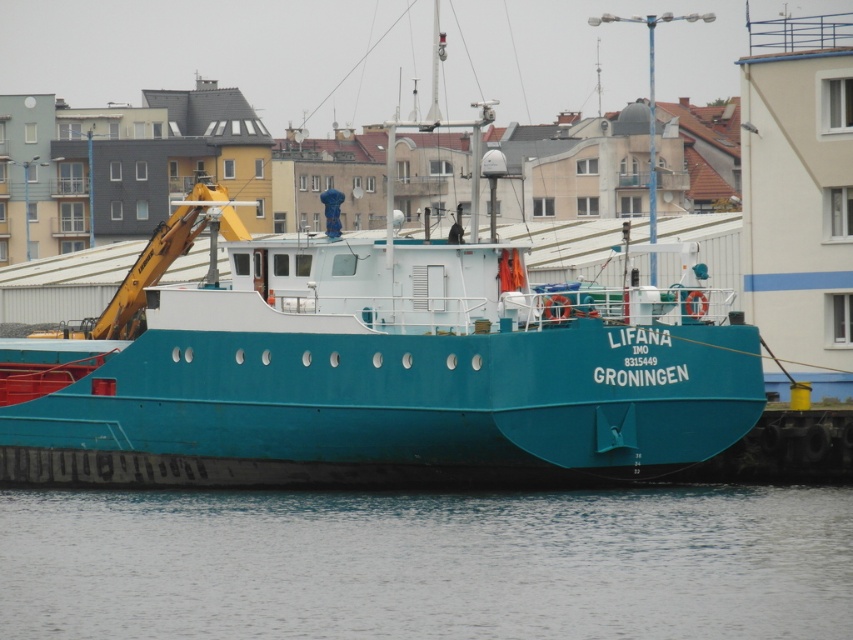
Question: Where is teal matte boat at center located in relation to transparent water at lower center in the image?

Choices:
 (A) left
 (B) right

Answer: (A)

Question: Is teal matte boat at center above transparent water at lower center?

Choices:
 (A) yes
 (B) no

Answer: (A)

Question: Is teal matte boat at center wider than transparent water at lower center?

Choices:
 (A) no
 (B) yes

Answer: (B)